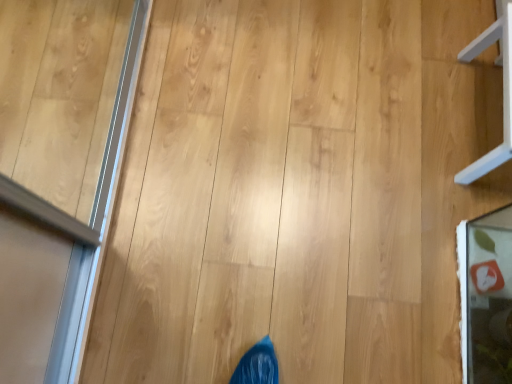
You are a GUI agent. You are given a task and a screenshot of the screen. Output one action in this format:
    pyautogui.click(x=<x>, y=<y>)
    Task: Click on the vacant point to the left of white matte chair at right
    
    Given the screenshot: What is the action you would take?
    pyautogui.click(x=395, y=113)